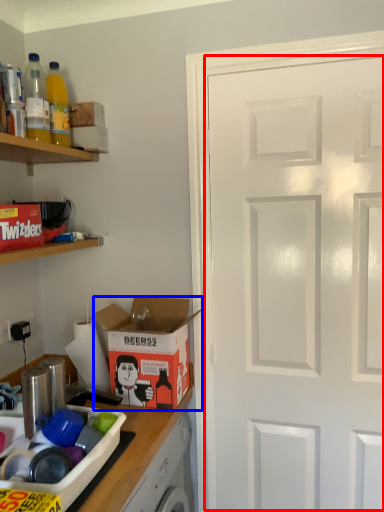
Question: Which point is further to the camera, door (highlighted by a red box) or cardboard box (highlighted by a blue box)?

Choices:
 (A) door
 (B) cardboard box

Answer: (B)